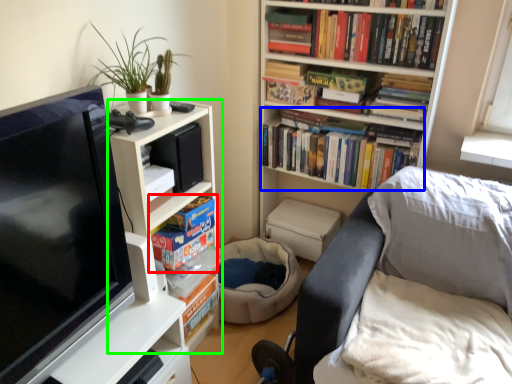
Question: Which object is positioned farthest from book (highlighted by a red box)? Select from book (highlighted by a blue box) and bookcase (highlighted by a green box).

Choices:
 (A) book
 (B) bookcase

Answer: (A)